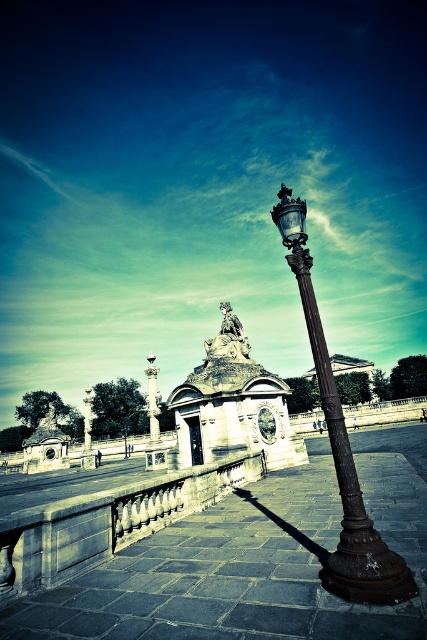
You are an urban planner assessing the layout of this outdoor space. Considering the bronze textured street light at center and the smooth white column at center, which object would require more space to accommodate its size during maintenance or replacement?

The smooth white column at center requires more space because it is larger than the bronze textured street light at center according to the description.

You are a photographer positioned at the entrance of the paved area. You want to capture a photo of the smooth white column at center without the bronze textured street light at center blocking it. Is this possible given their positions?

The bronze textured street light at center is in front of the smooth white column at center, so it will block the view of the smooth white column at center. To capture the column without obstruction, you would need to move to a position where the street light is not between you and the column.